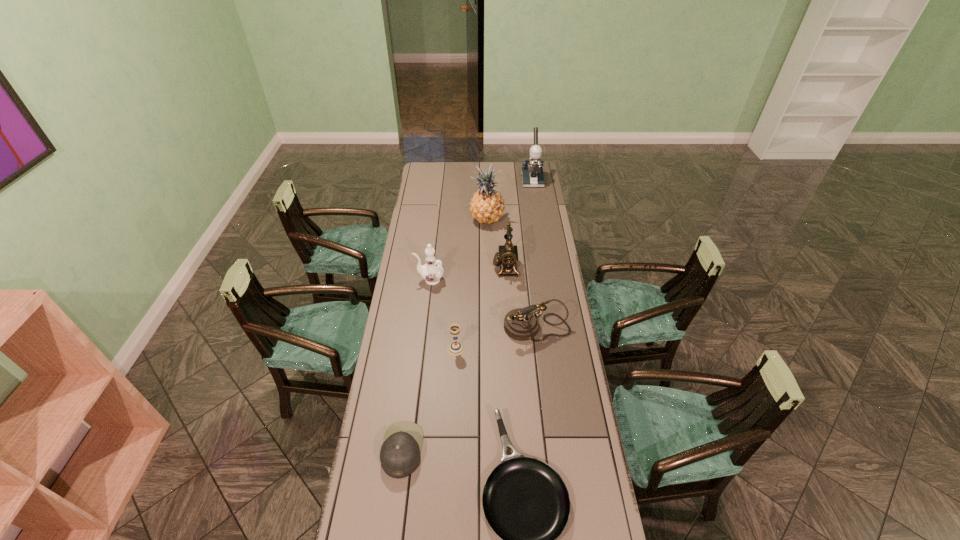
Locate an element on the screen. The width and height of the screenshot is (960, 540). free region located 0.380m on the rotary dial of the taller telephone is located at coordinates (414, 267).

Where is `vacant point located 0.160m on the rotary dial of the taller telephone`? vacant point located 0.160m on the rotary dial of the taller telephone is located at coordinates (460, 267).

Locate an element on the screen. This screenshot has height=540, width=960. free space located on the rotary dial of the taller telephone is located at coordinates (439, 267).

The height and width of the screenshot is (540, 960). In order to click on vacant region located 0.080m at the spout of the chinaware in this screenshot , I will do `click(397, 280)`.

I want to click on free spot located at the spout of the chinaware, so click(404, 280).

Find the location of a particular element. The image size is (960, 540). vacant space located on the back of the shorter telephone is located at coordinates (530, 271).

Identify the location of vacant region located 0.110m on the left of the sixth tallest object. The width and height of the screenshot is (960, 540). (420, 349).

Image resolution: width=960 pixels, height=540 pixels. Find the location of `vacant point located 0.110m on the brim of the cap`. vacant point located 0.110m on the brim of the cap is located at coordinates (455, 450).

Image resolution: width=960 pixels, height=540 pixels. I want to click on object located in the far edge section of the desktop, so click(532, 175).

Image resolution: width=960 pixels, height=540 pixels. I want to click on chinaware at the left edge, so click(x=431, y=272).